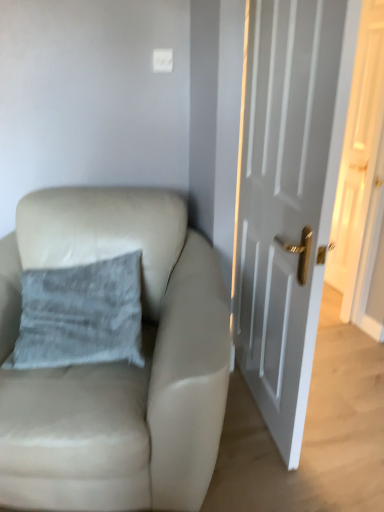
What do you see at coordinates (357, 141) in the screenshot? I see `white glossy door at right, which is the 1th door in right-to-left order` at bounding box center [357, 141].

Identify the location of gray fabric pillow at upper left. The height and width of the screenshot is (512, 384). (81, 315).

Identify the location of white glossy door at right, which is counted as the 1th door, starting from the back. Image resolution: width=384 pixels, height=512 pixels. (357, 141).

In the scene shown: How many degrees apart are the facing directions of beige leather chair at left and gray fabric pillow at upper left?

10.4 degrees.

Is beige leather chair at left positioned with its back to gray fabric pillow at upper left?

Yes, beige leather chair at left's orientation is away from gray fabric pillow at upper left.

Is gray fabric pillow at upper left located within beige leather chair at left?

That's correct, gray fabric pillow at upper left is inside beige leather chair at left.

Based on the photo, in terms of size, does beige leather chair at left appear bigger or smaller than gray fabric pillow at upper left?

Considering their sizes, beige leather chair at left takes up more space than gray fabric pillow at upper left.

Where is `door that is the 1st one above the beige leather chair at left (from a real-world perspective)`? door that is the 1st one above the beige leather chair at left (from a real-world perspective) is located at coordinates (286, 200).

From the image's perspective, is beige leather chair at left located above or below white glossy door at right, which appears as the 1th door when viewed from the left?

beige leather chair at left is situated lower than white glossy door at right, which appears as the 1th door when viewed from the left, in the image.

Between beige leather chair at left and white glossy door at right, positioned as the first door in front-to-back order, which one has less height?

beige leather chair at left.

Does beige leather chair at left turn towards white glossy door at right, the second door in the right-to-left sequence?

No, beige leather chair at left is not turned towards white glossy door at right, the second door in the right-to-left sequence.

Is white glossy door at right, positioned as the first door in front-to-back order, directly adjacent to gray fabric pillow at upper left?

white glossy door at right, positioned as the first door in front-to-back order, is not next to gray fabric pillow at upper left, and they're not touching.

Considering the positions of objects white glossy door at right, the second door in the right-to-left sequence, and gray fabric pillow at upper left in the image provided, who is behind, white glossy door at right, the second door in the right-to-left sequence, or gray fabric pillow at upper left?

gray fabric pillow at upper left is more distant.

How many degrees apart are the facing directions of white glossy door at right, the second door from the back, and gray fabric pillow at upper left?

They differ by 92 degrees in their facing directions.

Is white glossy door at right, which appears as the 1th door when viewed from the left, at the right side of beige leather chair at left?

Indeed, white glossy door at right, which appears as the 1th door when viewed from the left, is positioned on the right side of beige leather chair at left.

Is white glossy door at right, which appears as the 1th door when viewed from the left, inside the boundaries of beige leather chair at left, or outside?

The correct answer is: outside.

From the image's perspective, which is above, white glossy door at right, the second door in the right-to-left sequence, or beige leather chair at left?

white glossy door at right, the second door in the right-to-left sequence, from the image's perspective.

Does white glossy door at right, the second door from the back, turn towards beige leather chair at left?

Yes, white glossy door at right, the second door from the back, faces towards beige leather chair at left.

Would you say white glossy door at right, the 2th door from the left, is part of gray fabric pillow at upper left's contents?

That's incorrect, white glossy door at right, the 2th door from the left, is not inside gray fabric pillow at upper left.

From the image's perspective, does gray fabric pillow at upper left appear lower than white glossy door at right, which appears as the second door when viewed from the front?

Correct, gray fabric pillow at upper left appears lower than white glossy door at right, which appears as the second door when viewed from the front, in the image.

Can you confirm if gray fabric pillow at upper left is shorter than white glossy door at right, which is the 1th door in right-to-left order?

Yes.

Is point (109, 295) closer to viewer compared to point (364, 96)?

Yes, it is in front of point (364, 96).

Can you confirm if gray fabric pillow at upper left is positioned to the right of white glossy door at right, the second door from the back?

Incorrect, gray fabric pillow at upper left is not on the right side of white glossy door at right, the second door from the back.

Considering the sizes of objects gray fabric pillow at upper left and white glossy door at right, which appears as the 1th door when viewed from the left, in the image provided, who is thinner, gray fabric pillow at upper left or white glossy door at right, which appears as the 1th door when viewed from the left,?

Thinner between the two is white glossy door at right, which appears as the 1th door when viewed from the left.

From their relative heights in the image, would you say gray fabric pillow at upper left is taller or shorter than white glossy door at right, the second door in the right-to-left sequence?

In the image, gray fabric pillow at upper left appears to be shorter than white glossy door at right, the second door in the right-to-left sequence.

From the image's perspective, between gray fabric pillow at upper left and white glossy door at right, the second door from the back, who is located below?

gray fabric pillow at upper left.

Considering the relative sizes of gray fabric pillow at upper left and beige leather chair at left in the image provided, is gray fabric pillow at upper left taller than beige leather chair at left?

No, gray fabric pillow at upper left is not taller than beige leather chair at left.

Locate an element on the screen. pillow above the beige leather chair at left (from the image's perspective) is located at coordinates (81, 315).

Can you confirm if gray fabric pillow at upper left is wider than beige leather chair at left?

No.

You are a GUI agent. You are given a task and a screenshot of the screen. Output one action in this format:
    pyautogui.click(x=<x>, y=<y>)
    Task: Click on the pillow above the beige leather chair at left (from a real-world perspective)
    The width and height of the screenshot is (384, 512).
    Given the screenshot: What is the action you would take?
    pyautogui.click(x=81, y=315)

Find the location of a particular element. door that appears in front of the beige leather chair at left is located at coordinates (286, 200).

Which object lies further to the anchor point white glossy door at right, positioned as the first door in front-to-back order, gray fabric pillow at upper left or white glossy door at right, which is the 1th door in right-to-left order?

Among the two, white glossy door at right, which is the 1th door in right-to-left order, is located further to white glossy door at right, positioned as the first door in front-to-back order.

Which object lies nearer to the anchor point white glossy door at right, the 2th door from the left, white glossy door at right, which appears as the 1th door when viewed from the left, or gray fabric pillow at upper left?

white glossy door at right, which appears as the 1th door when viewed from the left.

Estimate the real-world distances between objects in this image. Which object is closer to gray fabric pillow at upper left, white glossy door at right, the second door from the back, or white glossy door at right, which is counted as the 1th door, starting from the back?

The object closer to gray fabric pillow at upper left is white glossy door at right, the second door from the back.

From the image, which object appears to be nearer to white glossy door at right, the second door in the right-to-left sequence, gray fabric pillow at upper left or beige leather chair at left?

beige leather chair at left.

From the image, which object appears to be farther from beige leather chair at left, white glossy door at right, the second door from the back, or gray fabric pillow at upper left?

Based on the image, white glossy door at right, the second door from the back, appears to be further to beige leather chair at left.

Looking at the image, which one is located closer to beige leather chair at left, white glossy door at right, which is counted as the 1th door, starting from the back, or white glossy door at right, the second door from the back?

The object closer to beige leather chair at left is white glossy door at right, the second door from the back.

Which object lies nearer to the anchor point white glossy door at right, which is counted as the 1th door, starting from the back, white glossy door at right, the second door from the back, or beige leather chair at left?

The object closer to white glossy door at right, which is counted as the 1th door, starting from the back, is white glossy door at right, the second door from the back.

Looking at the image, which one is located closer to gray fabric pillow at upper left, beige leather chair at left or white glossy door at right, positioned as the first door in front-to-back order?

beige leather chair at left is positioned closer to the anchor gray fabric pillow at upper left.

Find the location of a particular element. chair positioned between white glossy door at right, the second door from the back, and white glossy door at right, which is the 1th door in right-to-left order, from near to far is located at coordinates (117, 362).

Image resolution: width=384 pixels, height=512 pixels. Identify the location of chair between gray fabric pillow at upper left and white glossy door at right, which is the 1th door in right-to-left order, in the horizontal direction. (117, 362).

What are the coordinates of `door between gray fabric pillow at upper left and white glossy door at right, the 2th door from the left, from left to right` in the screenshot? It's located at (286, 200).

At what (x,y) coordinates should I click in order to perform the action: click on chair situated between gray fabric pillow at upper left and white glossy door at right, the second door from the back, from left to right. Please return your answer as a coordinate pair (x, y). Looking at the image, I should click on (117, 362).